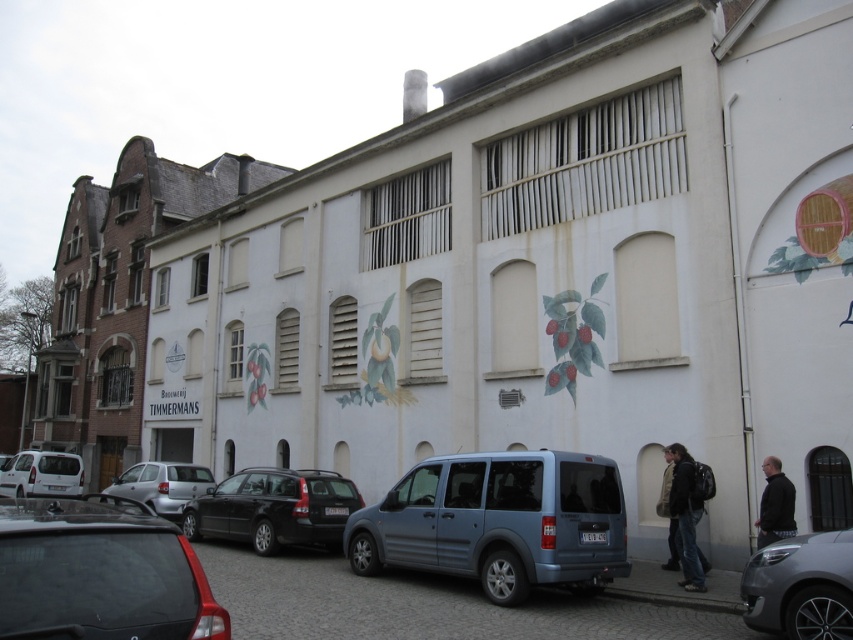
You are a delivery person needing to park your vehicle. You see a white matte van at lower left and a black matte jacket at lower right. Which parking spot can accommodate a larger vehicle?

The parking spot near the black matte jacket at lower right can accommodate a larger vehicle because the black matte jacket at lower right is larger than the white matte van at lower left.

You are a delivery person trying to park your white matte van at lower left between two parked vehicles. The space available is only 2 meters wide. Considering the width of the black matte jacket at lower right, can your van fit into the space?

The white matte van at lower left is thinner than the black matte jacket at lower right. Since the space is 2 meters wide, and the van is thinner than the jacket, it might still fit depending on the exact dimensions. However, without knowing the exact width of the jacket, it is uncertain. Please measure the space carefully before attempting to park.

You are a delivery driver who needs to park your vehicle in a spot that can accommodate taller vehicles. Based on the scene, which parking spot between the matte blue minivan at center and the satin silver van at lower right is more suitable for your vehicle?

The parking spot where the matte blue minivan at center is parked is more suitable because the matte blue minivan at center is much taller than the satin silver van at lower right, indicating that this spot can accommodate taller vehicles.